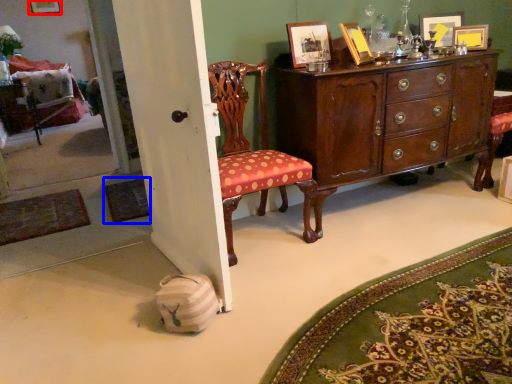
Question: Which point is closer to the camera, picture frame (highlighted by a red box) or mat (highlighted by a blue box)?

Choices:
 (A) picture frame
 (B) mat

Answer: (B)